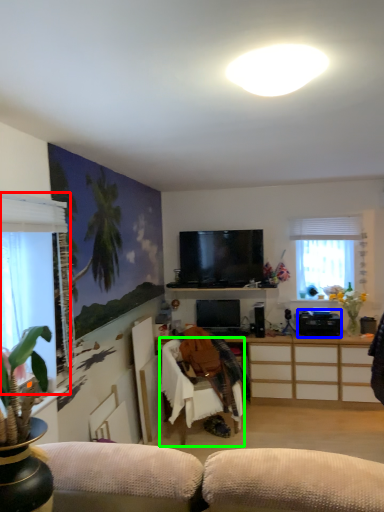
Question: Considering the real-world distances, which object is farthest from window (highlighted by a red box)? appliance (highlighted by a blue box) or chair (highlighted by a green box)?

Choices:
 (A) appliance
 (B) chair

Answer: (A)